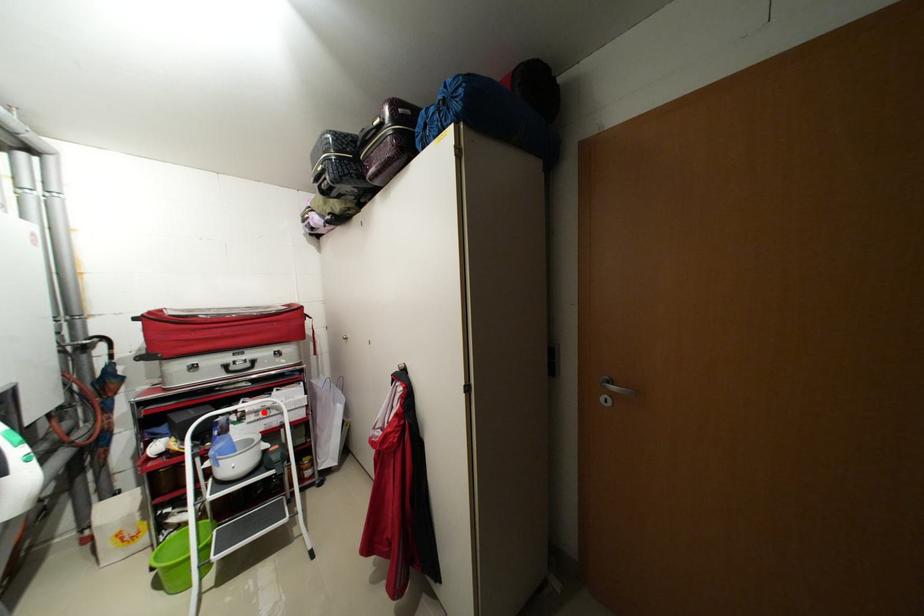
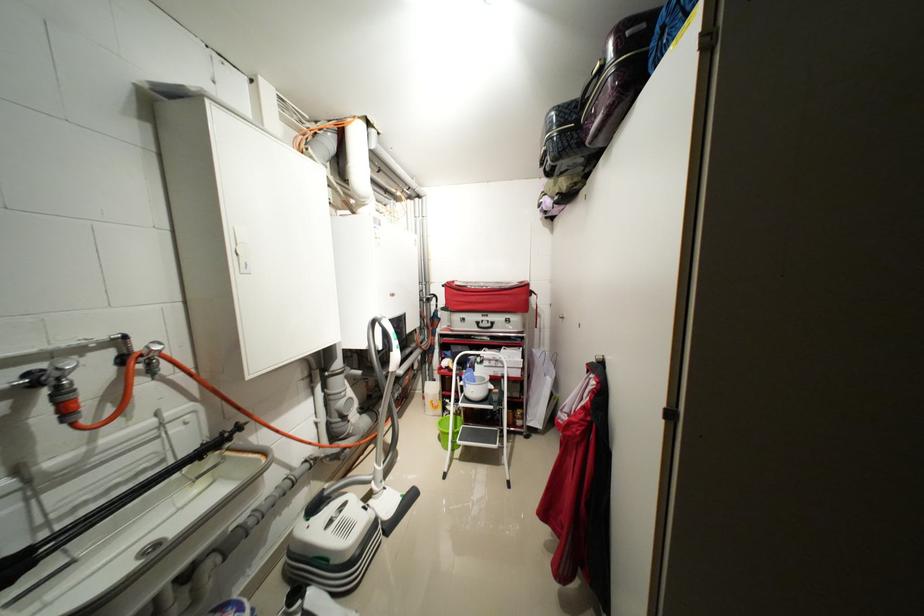
The point at the highlighted location is marked in the first image. Where is the corresponding point in the second image?

(496, 361)